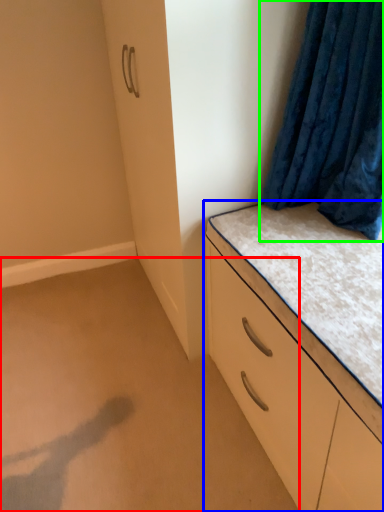
Question: Estimate the real-world distances between objects in this image. Which object is farther from plain (highlighted by a red box), chest of drawers (highlighted by a blue box) or curtain (highlighted by a green box)?

Choices:
 (A) chest of drawers
 (B) curtain

Answer: (B)